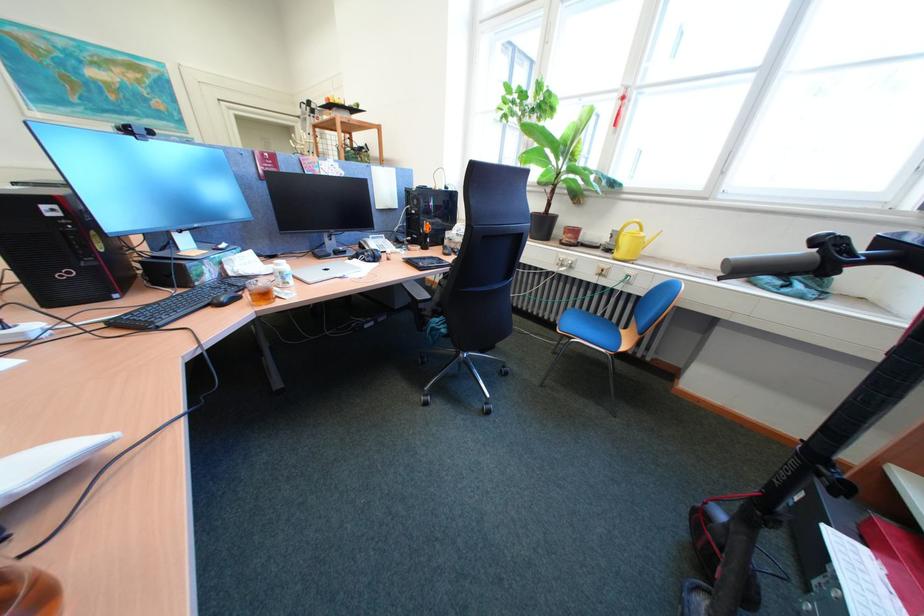
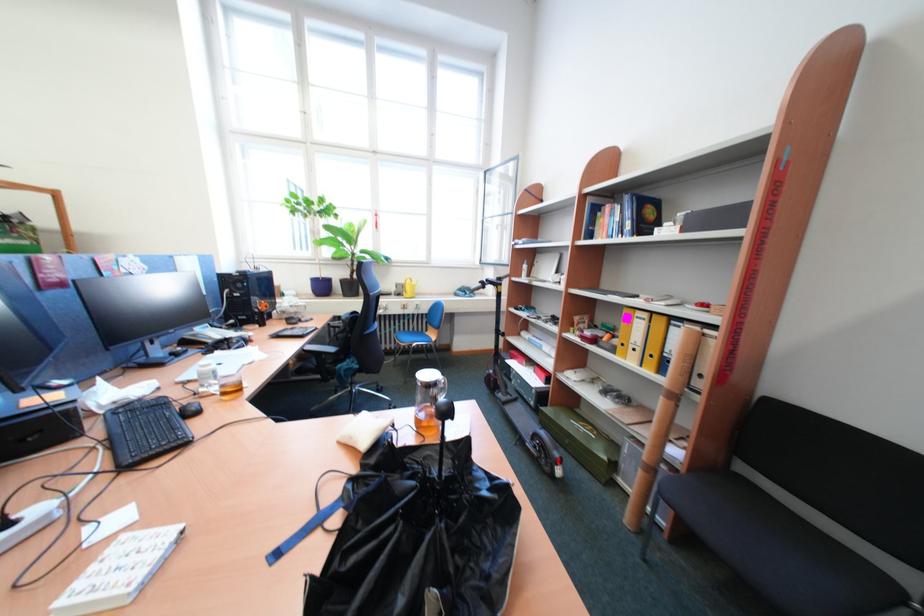
Where in the second image is the point corresponding to the point at 611,249 from the first image?

(403, 296)